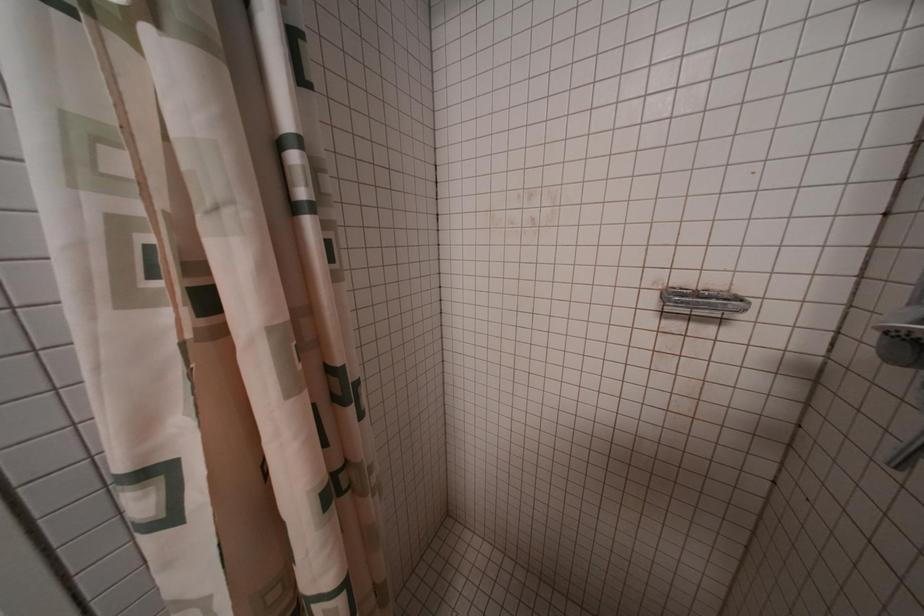
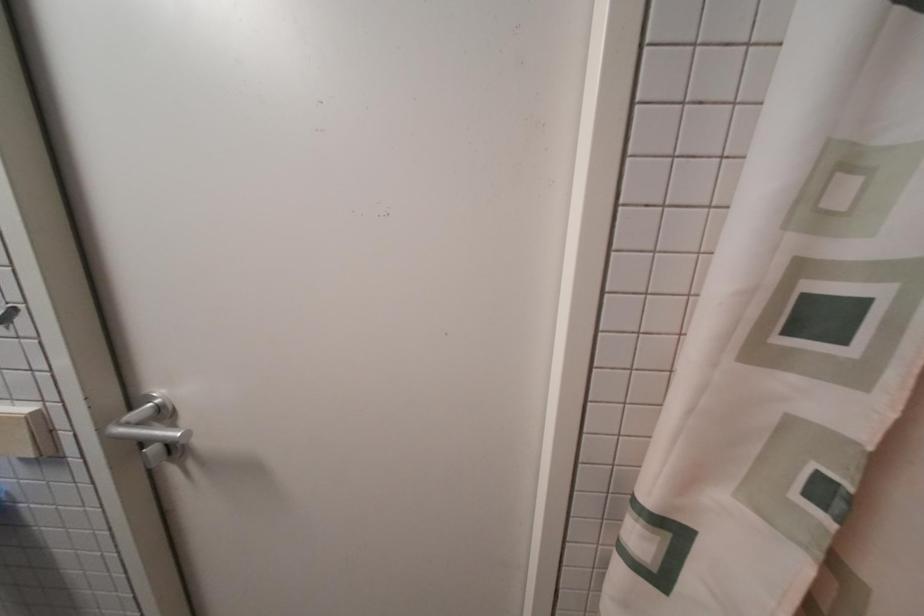
Question: The camera is either moving clockwise (left) or counter-clockwise (right) around the object. The first image is from the beginning of the video and the second image is from the end. Is the camera moving left or right when shooting the video?

Choices:
 (A) Left
 (B) Right

Answer: (B)